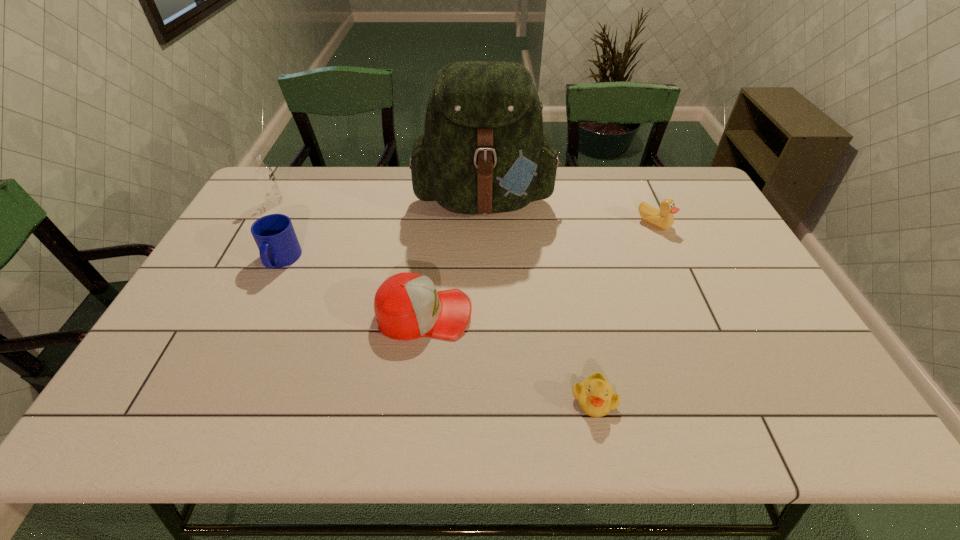
The width and height of the screenshot is (960, 540). Identify the location of vacant area at the far edge. (395, 167).

Locate an element on the screen. This screenshot has height=540, width=960. free space at the near edge of the desktop is located at coordinates (312, 417).

This screenshot has height=540, width=960. What are the coordinates of `blank area at the left edge` in the screenshot? It's located at (249, 231).

At what (x,y) coordinates should I click in order to perform the action: click on vacant space at the right edge. Please return your answer as a coordinate pair (x, y). The height and width of the screenshot is (540, 960). Looking at the image, I should click on (683, 222).

Identify the location of vacant region at the near left corner. (160, 401).

Find the location of `vacant region at the far right corner of the desktop`. vacant region at the far right corner of the desktop is located at coordinates (690, 181).

Where is `vacant space at the near right corner of the desktop`? The height and width of the screenshot is (540, 960). vacant space at the near right corner of the desktop is located at coordinates (813, 400).

The width and height of the screenshot is (960, 540). I want to click on vacant area that lies between the duck and the fifth object from right to left, so click(x=468, y=241).

The height and width of the screenshot is (540, 960). I want to click on free space that is in between the second nearest object and the tallest object, so click(455, 256).

I want to click on free space between the duckling and the rightmost object, so click(x=624, y=311).